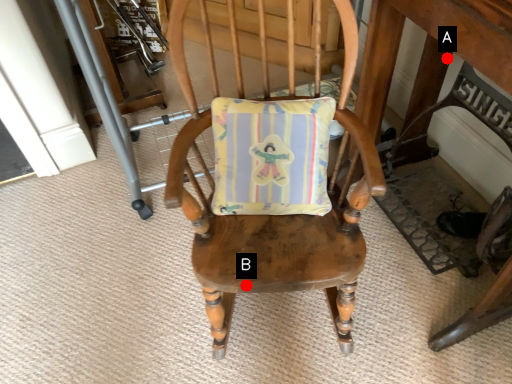
Question: Two points are circled on the image, labeled by A and B beside each circle. Which point is closer to the camera taking this photo?

Choices:
 (A) A is closer
 (B) B is closer

Answer: (B)